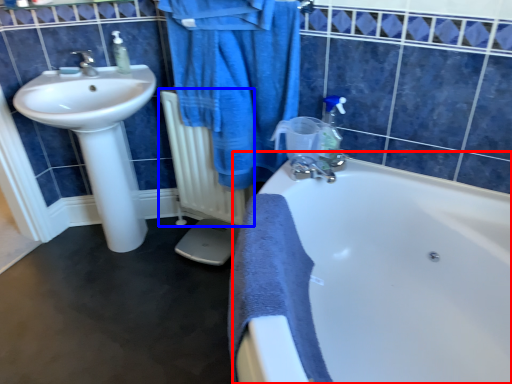
Question: Among these objects, which one is nearest to the camera, bathtub (highlighted by a red box) or radiator (highlighted by a blue box)?

Choices:
 (A) bathtub
 (B) radiator

Answer: (A)